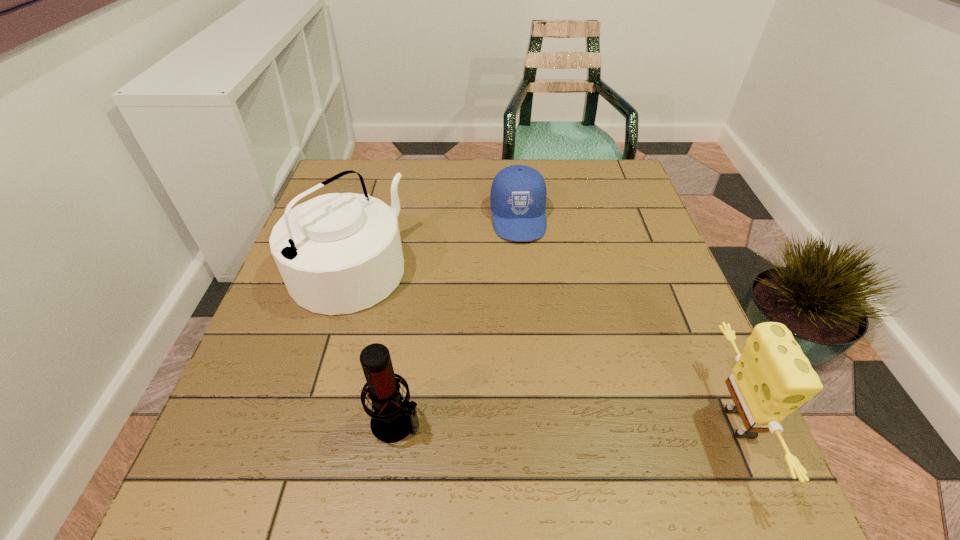
Find the location of a particular element. free space between the shortest object and the microphone is located at coordinates click(x=458, y=320).

This screenshot has height=540, width=960. Find the location of `free spot between the shortest object and the rightmost object`. free spot between the shortest object and the rightmost object is located at coordinates (630, 320).

Find the location of a particular element. The image size is (960, 540). vacant space that is in between the third object from left to right and the rightmost object is located at coordinates (630, 320).

The height and width of the screenshot is (540, 960). What are the coordinates of `free space that is in between the rightmost object and the microphone` in the screenshot? It's located at (569, 422).

The height and width of the screenshot is (540, 960). In order to click on vacant region between the shortest object and the sponge in this screenshot , I will do `click(630, 320)`.

Image resolution: width=960 pixels, height=540 pixels. I want to click on the third closest object to the sponge, so (339, 253).

Locate an element on the screen. the closest object relative to the microphone is located at coordinates click(339, 253).

Locate an element on the screen. Image resolution: width=960 pixels, height=540 pixels. free space in the image that satisfies the following two spatial constraints: 1. on the front side of the microphone; 2. on the face of the rightmost object is located at coordinates (396, 423).

At what (x,y) coordinates should I click in order to perform the action: click on free location that satisfies the following two spatial constraints: 1. on the front side of the microphone; 2. on the right side of the kettle. Please return your answer as a coordinate pair (x, y). This screenshot has width=960, height=540. Looking at the image, I should click on (301, 422).

The image size is (960, 540). Identify the location of free location that satisfies the following two spatial constraints: 1. on the back side of the kettle; 2. on the left side of the cap. (364, 218).